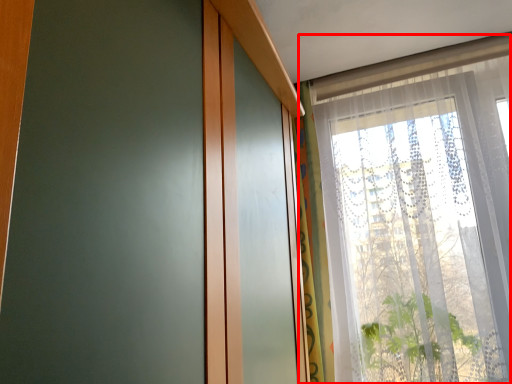
Question: From the image's perspective, what is the correct spatial positioning of window (annotated by the red box) in reference to curtain?

Choices:
 (A) below
 (B) above

Answer: (B)